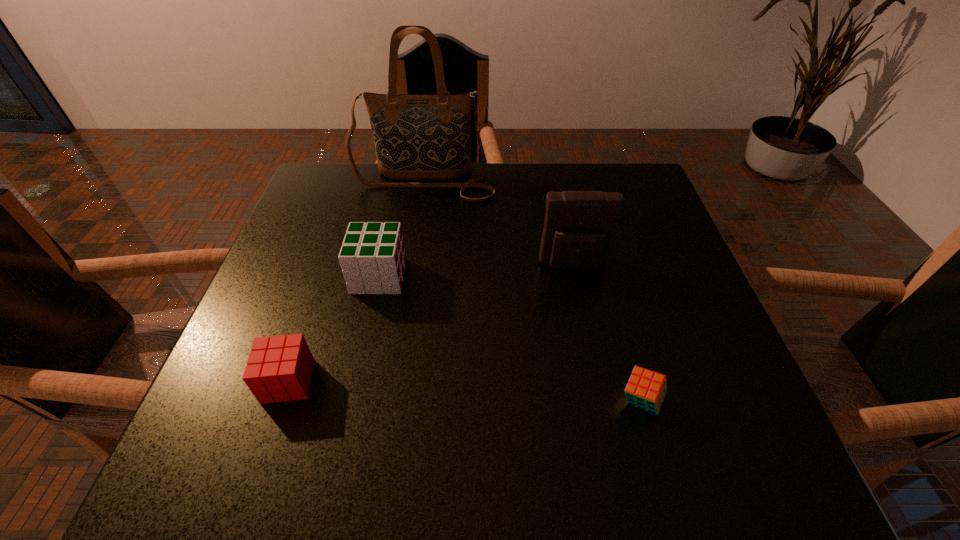
I want to click on vacant space at the right edge of the desktop, so click(662, 421).

In the image, there is a desktop. Where is `vacant region at the far left corner`? The width and height of the screenshot is (960, 540). vacant region at the far left corner is located at coordinates pos(337,165).

Locate an element on the screen. The width and height of the screenshot is (960, 540). free space at the far right corner of the desktop is located at coordinates (637, 167).

The height and width of the screenshot is (540, 960). I want to click on blank region between the rightmost cube and the second cube from right to left, so click(510, 339).

The width and height of the screenshot is (960, 540). Find the location of `vacant space that is in between the second tallest object and the rightmost cube`. vacant space that is in between the second tallest object and the rightmost cube is located at coordinates (607, 333).

The height and width of the screenshot is (540, 960). In order to click on blank region between the fourth shortest object and the third tallest object in this screenshot , I will do `click(476, 271)`.

In order to click on vacant space that is in between the rightmost cube and the second tallest object in this screenshot , I will do `click(607, 333)`.

This screenshot has width=960, height=540. In order to click on free point between the third shortest object and the rightmost cube in this screenshot , I will do `click(510, 339)`.

Where is `free area in between the farthest cube and the fourth shortest object`? free area in between the farthest cube and the fourth shortest object is located at coordinates (476, 271).

Where is `empty location between the rightmost cube and the tallest object`? The image size is (960, 540). empty location between the rightmost cube and the tallest object is located at coordinates (532, 291).